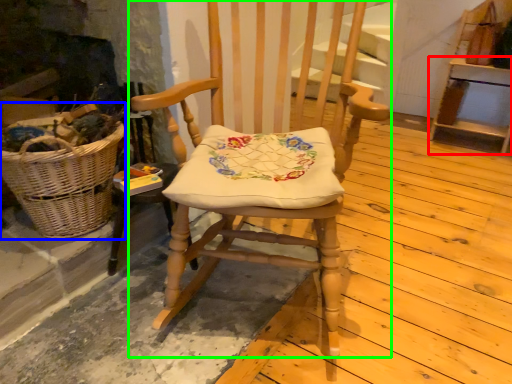
Question: Based on their relative distances, which object is nearer to furniture (highlighted by a red box)? Choose from picnic basket (highlighted by a blue box) and chair (highlighted by a green box).

Choices:
 (A) picnic basket
 (B) chair

Answer: (B)